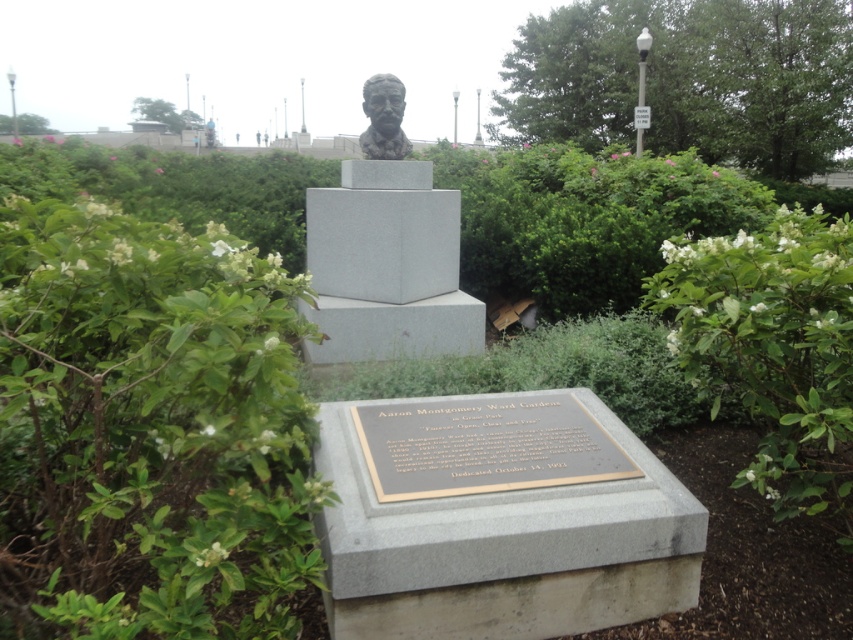
You are a gardener who needs to trim bushes in the memorial area. You see a green leafy bush at center and a white leafy bush at center. Which bush should you trim first if you want to start with the smaller one?

The green leafy bush at center is smaller than the white leafy bush at center, so you should trim the green leafy bush at center first.

You are a gardener who needs to water both the green leafy bush at center and the green leafy bush at upper right. Given that your watering can holds enough water to cover 15 meters of distance, can you water both bushes without refilling?

The green leafy bush at center and the green leafy bush at upper right are 13.73 meters apart, so yes, you can water both bushes without refilling since the distance between them is within the 15 meters capacity of your watering can.